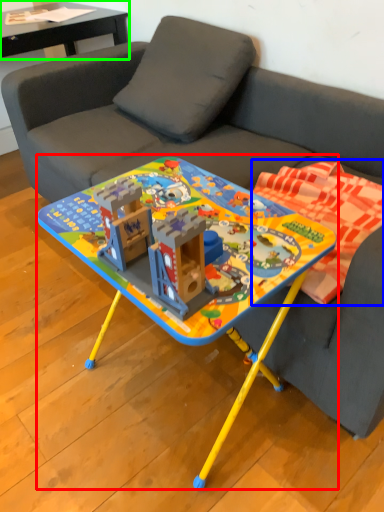
Question: Which is nearer to the table (highlighted by a red box)? blanket (highlighted by a blue box) or table (highlighted by a green box).

Choices:
 (A) blanket
 (B) table

Answer: (A)